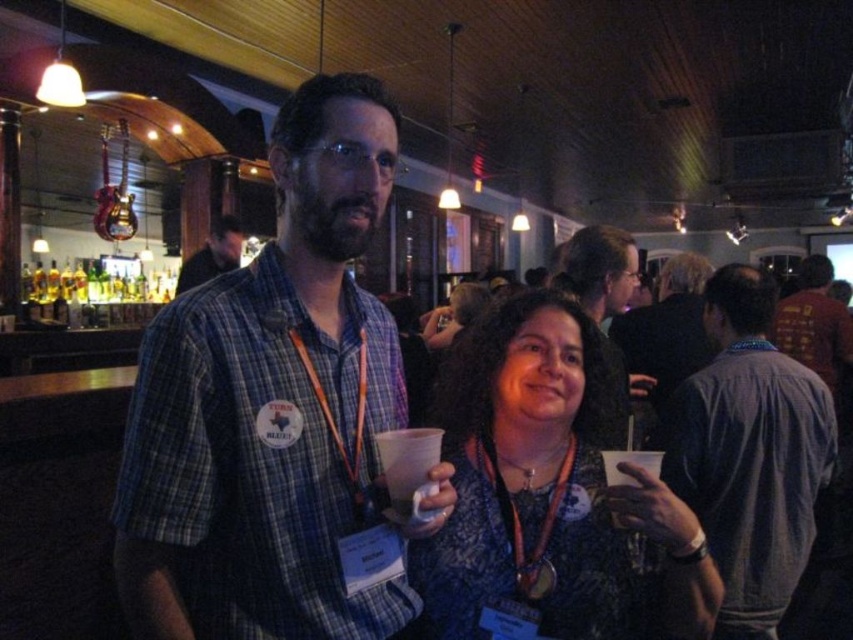
Question: Can you confirm if gray fabric shirt at right is positioned to the right of matte black shirt at center?

Choices:
 (A) yes
 (B) no

Answer: (A)

Question: Is matte black shirt at center smaller than red shirt at center?

Choices:
 (A) no
 (B) yes

Answer: (B)

Question: Which point is closer to the camera taking this photo?

Choices:
 (A) (331, 166)
 (B) (544, 387)
 (C) (825, 317)

Answer: (A)

Question: Which point is farther to the camera?

Choices:
 (A) matte plaid shirt at center
 (B) gray fabric shirt at right
 (C) matte black shirt at center
 (D) blue lace dress at center

Answer: (A)

Question: Which object is the farthest from the red shirt at center?

Choices:
 (A) matte black shirt at center
 (B) gray fabric shirt at right

Answer: (B)

Question: Does plaid shirt at center have a greater width compared to matte plaid shirt at center?

Choices:
 (A) yes
 (B) no

Answer: (B)